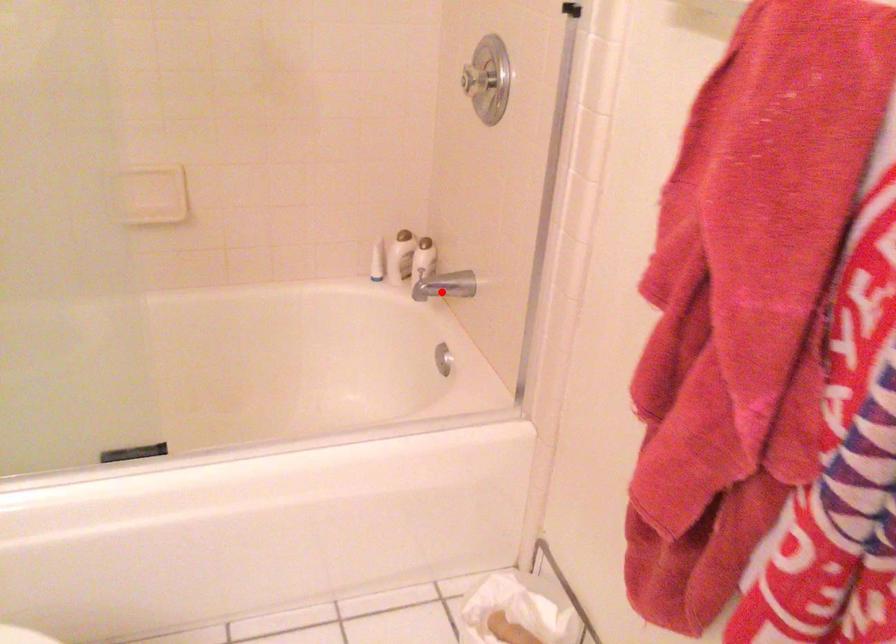
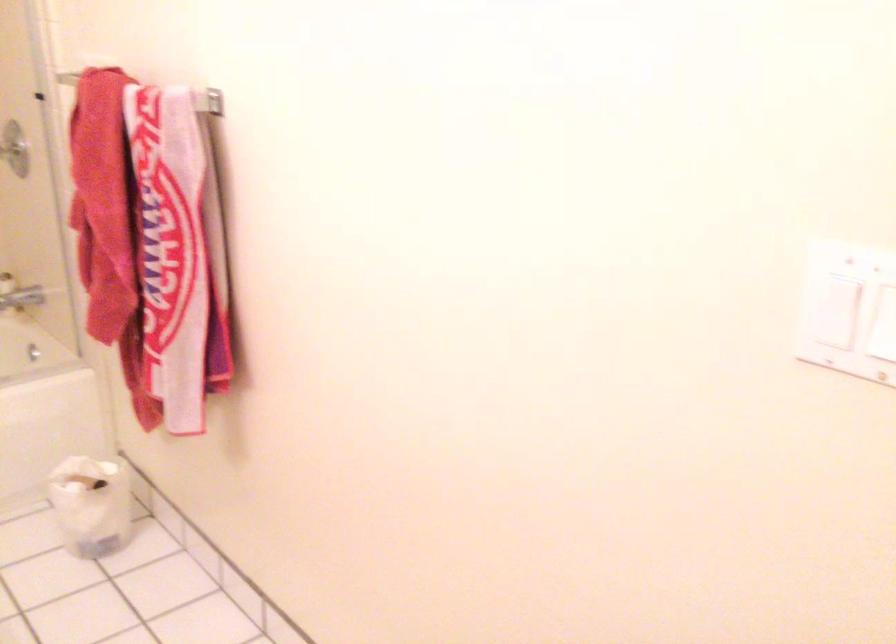
The point at the highlighted location is marked in the first image. Where is the corresponding point in the second image?

(20, 299)